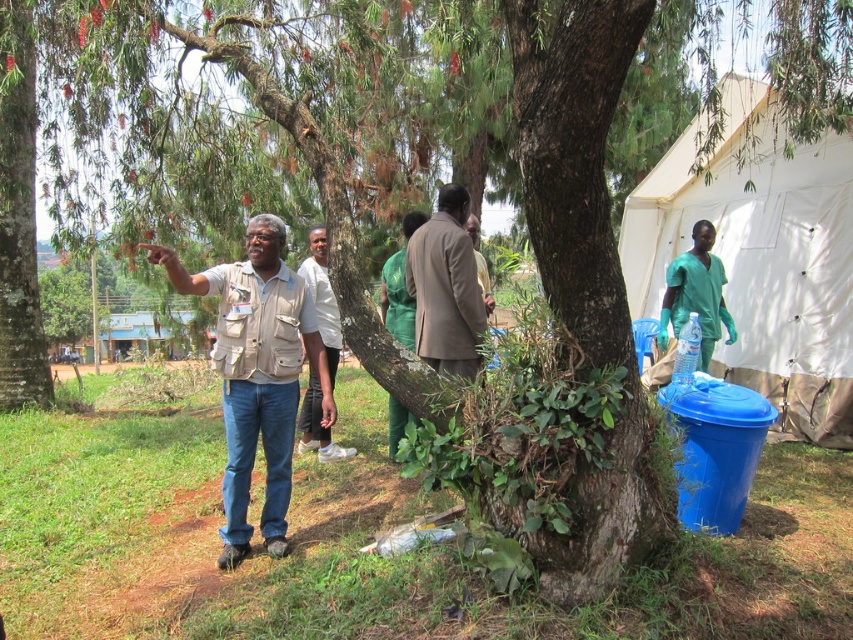
You are a photographer trying to capture a group photo of the beige fabric shirt at center and the white matte shirt at center. Which person should you focus on first to ensure they are in the frame, considering their heights?

The beige fabric shirt at center is taller than the white matte shirt at center, so you should focus on the beige fabric shirt at center first to ensure they are in the frame.

You are a delivery person who needs to place a package between the white fabric tent at upper right and the green scrubs at right. The package requires at least 6 feet of space to be safely placed. Can you fit it there?

The distance between the white fabric tent at upper right and the green scrubs at right is 6.01 feet, which is just over the required 6 feet. Therefore, the package can be safely placed there.